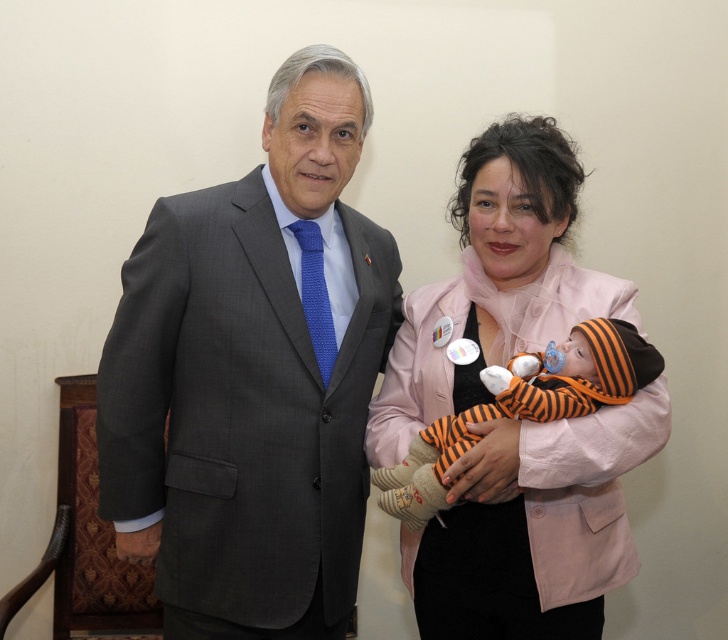
Does matte gray suit at left have a greater height compared to orange striped fabric baby at center?

Yes.

How far apart are matte gray suit at left and orange striped fabric baby at center?

The distance of matte gray suit at left from orange striped fabric baby at center is 38.52 centimeters.

Image resolution: width=728 pixels, height=640 pixels. Describe the element at coordinates (253, 376) in the screenshot. I see `matte gray suit at left` at that location.

Identify the location of matte gray suit at left. (253, 376).

Is orange striped fabric baby at center closer to the viewer compared to blue knitted tie at center?

Yes.

At what (x,y) coordinates should I click in order to perform the action: click on orange striped fabric baby at center. Please return your answer as a coordinate pair (x, y). This screenshot has height=640, width=728. Looking at the image, I should click on tap(521, 406).

The width and height of the screenshot is (728, 640). Find the location of `orange striped fabric baby at center`. orange striped fabric baby at center is located at coordinates (521, 406).

Does point (301, 198) lie behind point (545, 339)?

No, (301, 198) is in front of (545, 339).

Who is positioned more to the left, matte gray suit at left or pink fabric baby at center?

From the viewer's perspective, matte gray suit at left appears more on the left side.

Which is behind, point (205, 436) or point (466, 166)?

Point (466, 166)

Image resolution: width=728 pixels, height=640 pixels. Find the location of `matte gray suit at left`. matte gray suit at left is located at coordinates (253, 376).